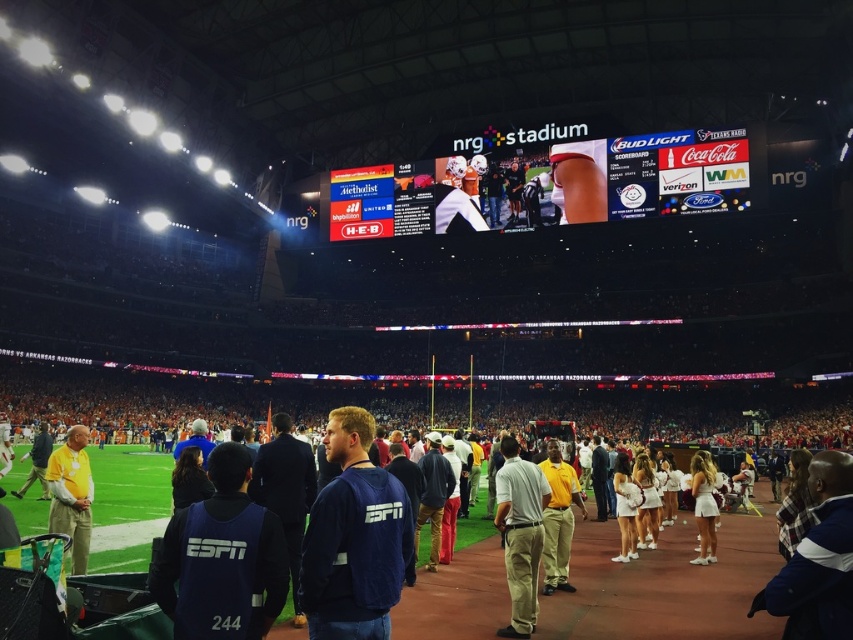
Question: Can you confirm if blue fleece jacket at lower left is positioned to the left of white fabric cheerleader at center?

Choices:
 (A) no
 (B) yes

Answer: (B)

Question: Which of these objects is positioned closest to the khaki pants at center?

Choices:
 (A) white fabric cheerleader at center
 (B) navy blue jacket at center
 (C) blue fleece jacket at lower left

Answer: (B)

Question: Which is nearer to the dark blue jacket at lower right?

Choices:
 (A) khaki pants at center
 (B) white matte tennis skirt at center
 (C) blue fleece jacket at lower left
 (D) yellow shirt at center

Answer: (A)

Question: Is khaki pants at center to the left of yellow shirt at center from the viewer's perspective?

Choices:
 (A) no
 (B) yes

Answer: (A)

Question: From the image, what is the correct spatial relationship of navy blue jacket at center in relation to yellow matte shirt at lower left?

Choices:
 (A) above
 (B) below

Answer: (A)

Question: Which object is the closest to the dark blue jacket at lower right?

Choices:
 (A) khaki pants at center
 (B) white matte tennis skirt at center

Answer: (A)